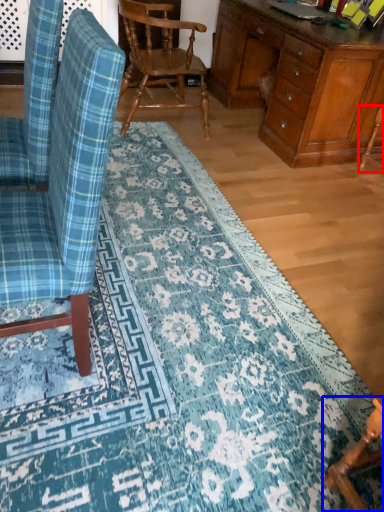
Question: Which point is further to the camera, armchair (highlighted by a red box) or chair (highlighted by a blue box)?

Choices:
 (A) armchair
 (B) chair

Answer: (A)